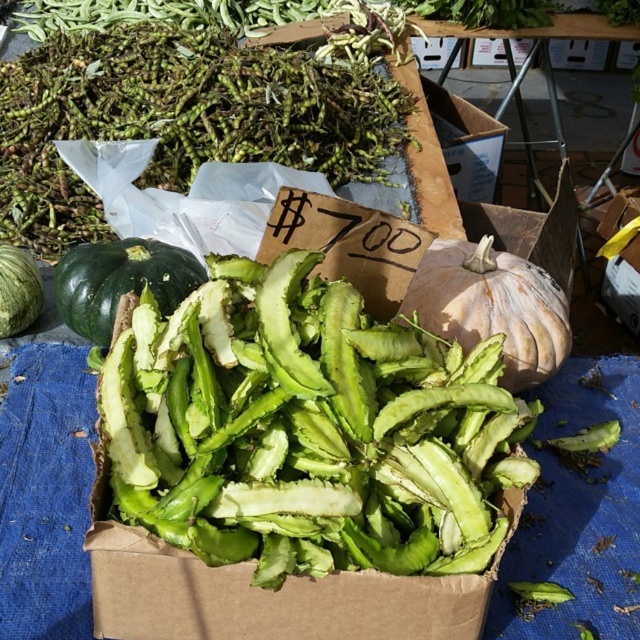
Question: Among these objects, which one is farthest from the camera?

Choices:
 (A) speckled white pumpkin at center
 (B) green matte string beans at center
 (C) green matte pumpkin at left
 (D) green matte watermelon at left

Answer: (D)

Question: Does speckled white pumpkin at center have a greater width compared to green matte watermelon at left?

Choices:
 (A) no
 (B) yes

Answer: (B)

Question: Observing the image, what is the correct spatial positioning of green rough string beans at upper left in reference to speckled white pumpkin at center?

Choices:
 (A) below
 (B) above

Answer: (B)

Question: Does green matte string beans at center lie in front of speckled white pumpkin at center?

Choices:
 (A) no
 (B) yes

Answer: (B)

Question: Estimate the real-world distances between objects in this image. Which object is farther from the green matte string beans at center?

Choices:
 (A) speckled white pumpkin at center
 (B) green matte watermelon at left

Answer: (B)

Question: Which object appears closest to the camera in this image?

Choices:
 (A) green matte pumpkin at left
 (B) green matte string beans at center
 (C) green rough string beans at upper left

Answer: (B)